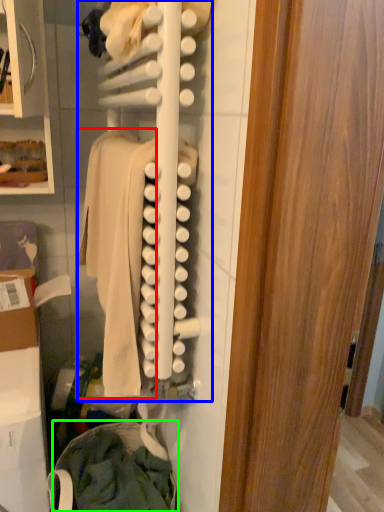
Question: Which object is positioned closest to clothing (highlighted by a red box)? Select from closet (highlighted by a blue box) and clothing (highlighted by a green box).

Choices:
 (A) closet
 (B) clothing

Answer: (A)